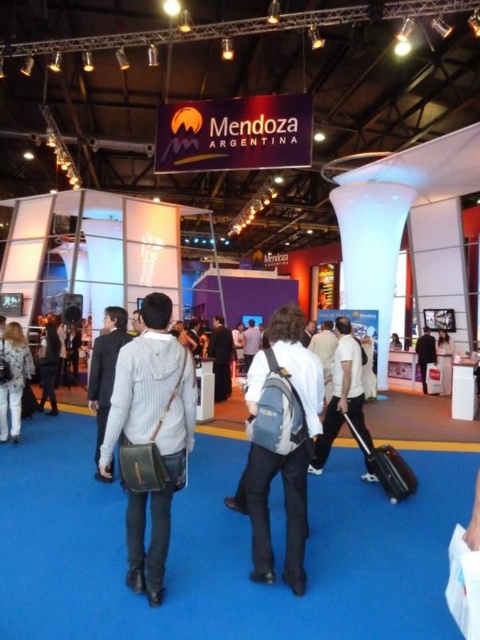
Question: Based on their relative distances, which object is nearer to the dark gray suit at center?

Choices:
 (A) denim jacket at lower left
 (B) matte gray sweater at center

Answer: (A)

Question: Is white matte backpack at center below dark gray suit at center?

Choices:
 (A) yes
 (B) no

Answer: (A)

Question: Which point is closer to the camera taking this photo?

Choices:
 (A) (147, 596)
 (B) (349, 401)

Answer: (A)

Question: From the image, what is the correct spatial relationship of matte gray sweater at center in relation to white matte backpack at center?

Choices:
 (A) above
 (B) below

Answer: (A)

Question: Estimate the real-world distances between objects in this image. Which object is closer to the white matte backpack at center?

Choices:
 (A) denim jacket at lower left
 (B) dark gray suit at center
 (C) gray fabric backpack at center

Answer: (C)

Question: Is matte gray sweater at center bigger than white matte backpack at center?

Choices:
 (A) yes
 (B) no

Answer: (B)